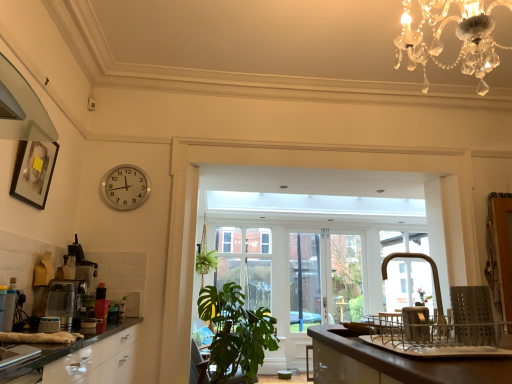
Question: From a real-world perspective, is silver metallic clock at upper left above or below satin silver coffee machine at left, placed as the second coffee machine when sorted from back to front?

Choices:
 (A) above
 (B) below

Answer: (A)

Question: In terms of height, does silver metallic clock at upper left look taller or shorter compared to satin silver coffee machine at left, placed as the second coffee machine when sorted from back to front?

Choices:
 (A) short
 (B) tall

Answer: (B)

Question: Which is nearer to the satin silver coffee machine at left, which is counted as the first coffee machine, starting from the front?

Choices:
 (A) silver metallic clock at upper left
 (B) green leafy plant at lower center
 (C) clear glass door at center
 (D) clear glass window at center
 (E) satin silver coffee machine at left, positioned as the 1th coffee machine in back-to-front order

Answer: (E)

Question: Which object is the closest to the clear glass window at center?

Choices:
 (A) satin silver coffee machine at left, the 2th coffee machine when ordered from front to back
 (B) silver metallic clock at upper left
 (C) satin silver coffee machine at left, which is counted as the first coffee machine, starting from the front
 (D) green leafy plant at lower center
 (E) clear glass door at center

Answer: (E)